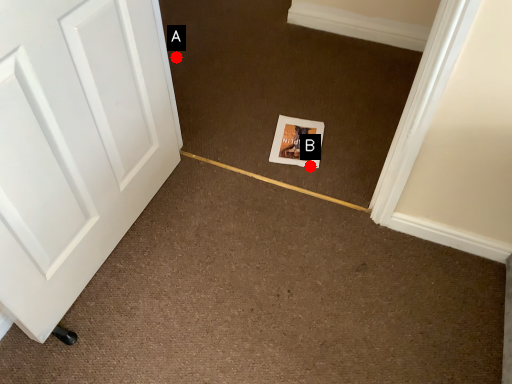
Question: Two points are circled on the image, labeled by A and B beside each circle. Which point is farther to the camera?

Choices:
 (A) A is further
 (B) B is further

Answer: (A)